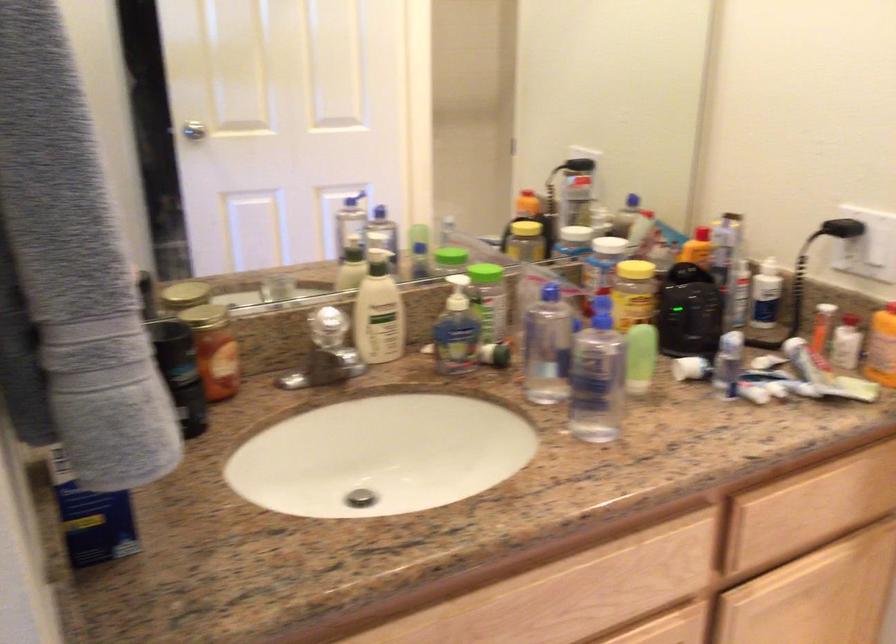
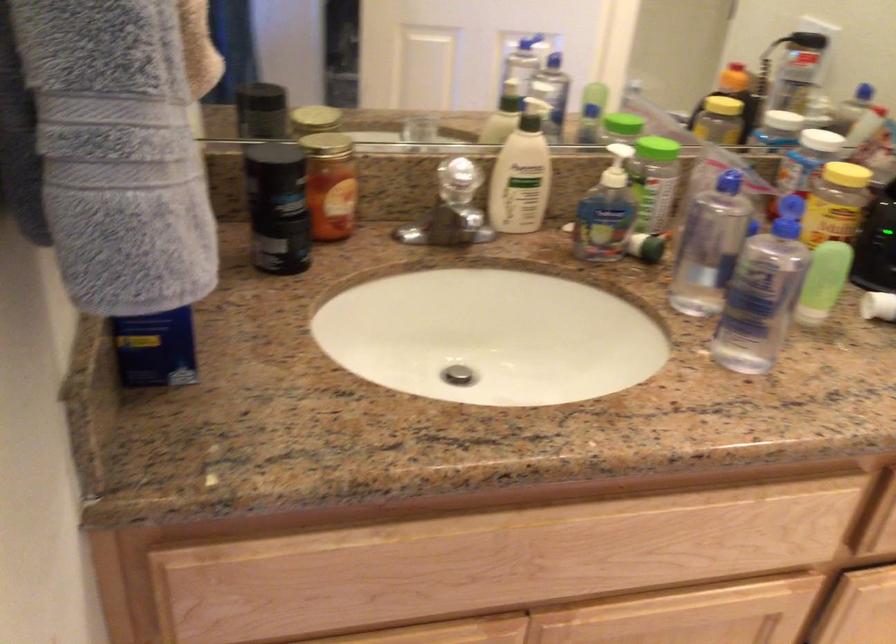
Question: Based on the continuous images, in which direction is the camera rotating? Reply with the corresponding letter.

Choices:
 (A) Left
 (B) Right
 (C) Up
 (D) Down

Answer: (D)